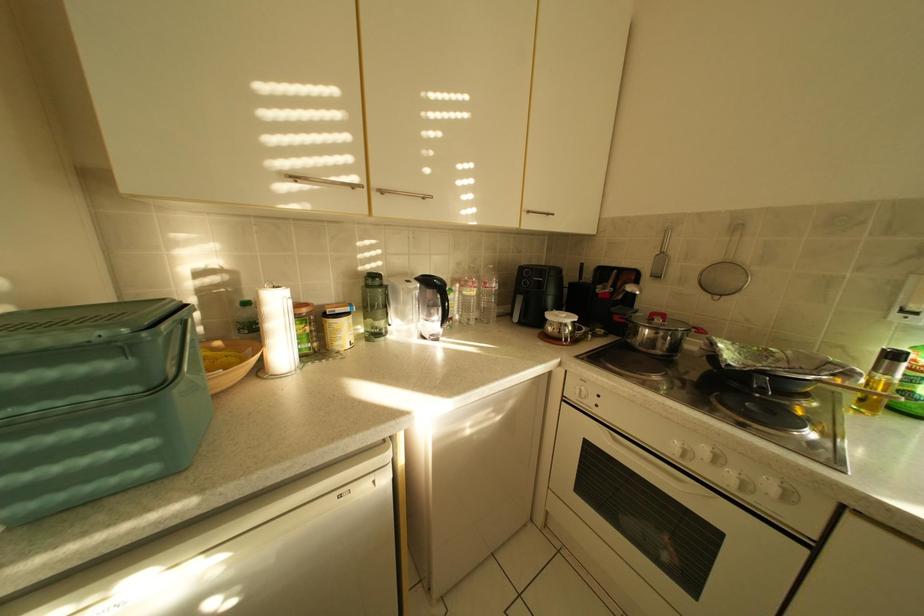
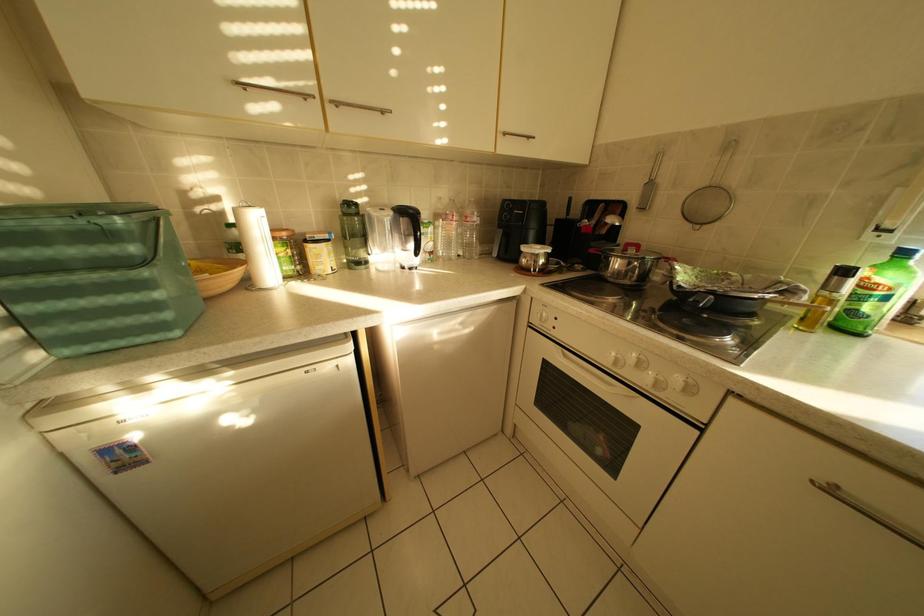
Question: What movement of the cameraman would produce the second image?

Choices:
 (A) Left
 (B) Right
 (C) Forward
 (D) Backward

Answer: (B)